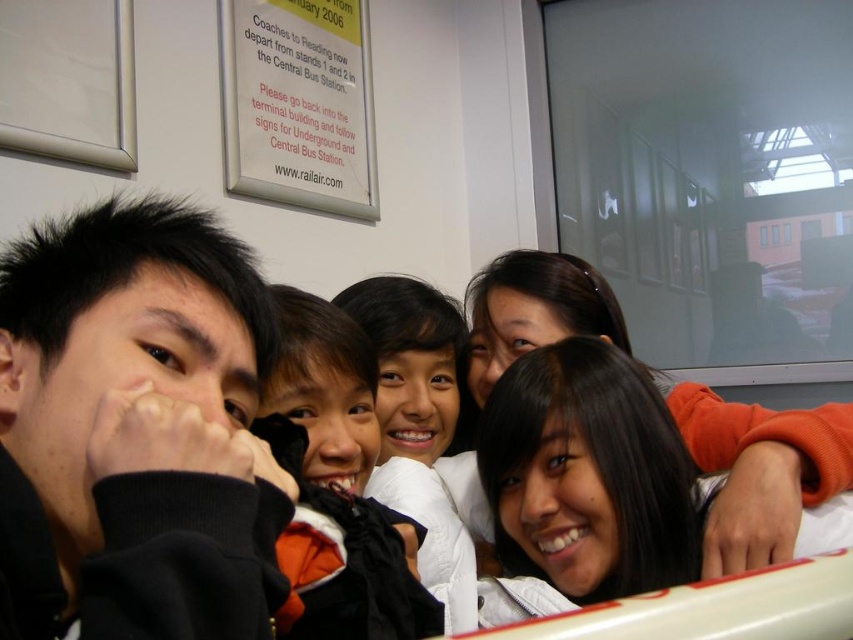
Question: In this image, where is black fleece at left located relative to white paper sign at upper center?

Choices:
 (A) right
 (B) left

Answer: (A)

Question: Can you confirm if black fleece at left is wider than orange fleece jacket at center?

Choices:
 (A) no
 (B) yes

Answer: (B)

Question: Which point is farther to the camera?

Choices:
 (A) (323, 68)
 (B) (10, 552)

Answer: (A)

Question: Which object is the closest to the orange fleece jacket at center?

Choices:
 (A) white paper sign at upper center
 (B) black fleece at left

Answer: (B)

Question: Can you confirm if black fleece at left is positioned to the left of white paper sign at upper center?

Choices:
 (A) no
 (B) yes

Answer: (A)

Question: Which object is the farthest from the orange fleece jacket at center?

Choices:
 (A) black fleece at left
 (B) white paper sign at upper center

Answer: (B)